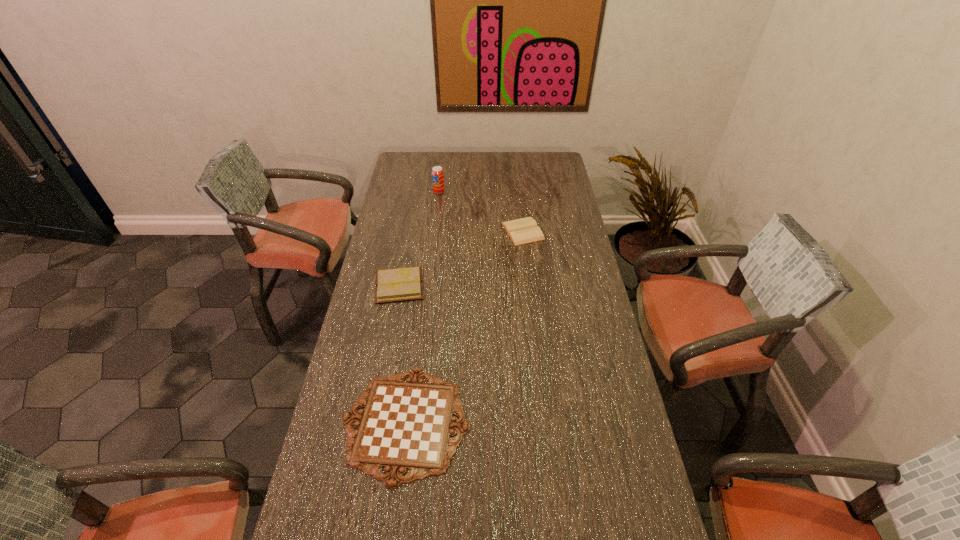
Locate an element on the screen. The width and height of the screenshot is (960, 540). soda can is located at coordinates (437, 173).

The height and width of the screenshot is (540, 960). Find the location of `the tallest object`. the tallest object is located at coordinates (437, 173).

The image size is (960, 540). Find the location of `the rightmost object`. the rightmost object is located at coordinates (521, 231).

This screenshot has height=540, width=960. Find the location of `the right diary`. the right diary is located at coordinates (521, 231).

Locate an element on the screen. The image size is (960, 540). the nearer diary is located at coordinates (400, 284).

The height and width of the screenshot is (540, 960). I want to click on the left diary, so 400,284.

Where is `the nearest object`? This screenshot has height=540, width=960. the nearest object is located at coordinates (405, 425).

I want to click on chessboard, so click(405, 425).

Find the location of a particular element. Image resolution: width=960 pixels, height=540 pixels. free space located on the front of the soda can is located at coordinates (432, 249).

You are a GUI agent. You are given a task and a screenshot of the screen. Output one action in this format:
    pyautogui.click(x=<x>, y=<y>)
    Task: Click on the free space located 0.250m on the left of the rightmost object
    The width and height of the screenshot is (960, 540).
    Given the screenshot: What is the action you would take?
    pyautogui.click(x=443, y=231)